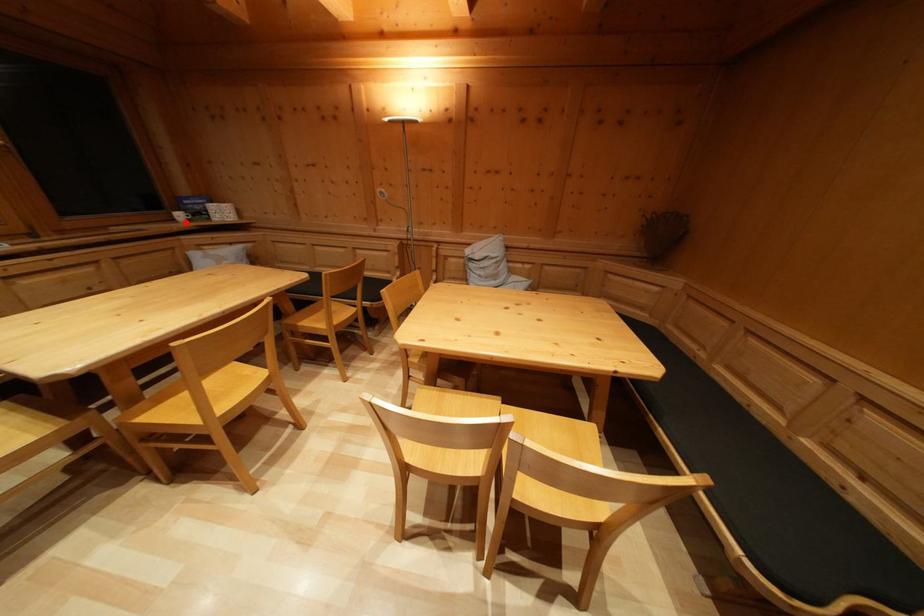
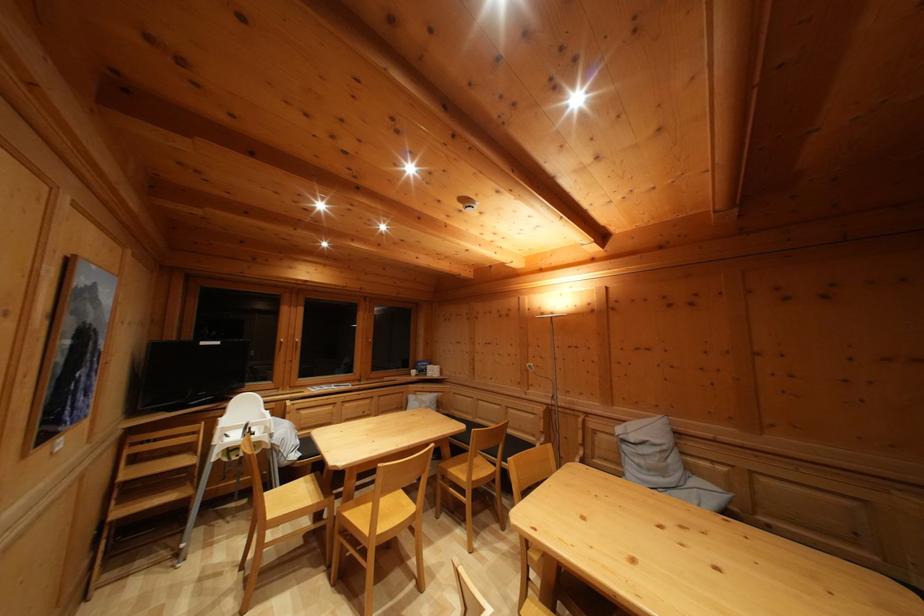
Question: A red point is marked in image1. In image2, is the corresponding 3D point closer to the camera or farther? Reply with the corresponding letter.

Choices:
 (A) The corresponding 3D point is closer.
 (B) The corresponding 3D point is farther.

Answer: (B)